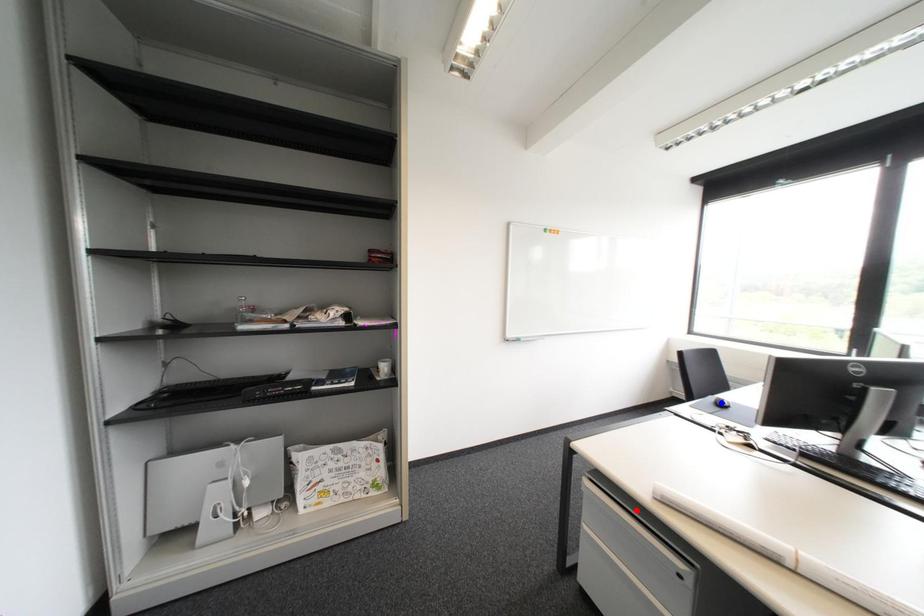
Question: In the image, two points are highlighted. Which point is nearer to the camera? Reply with the corresponding letter.

Choices:
 (A) blue point
 (B) red point

Answer: (B)